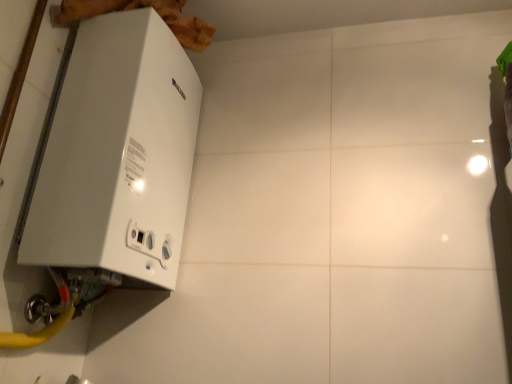
The height and width of the screenshot is (384, 512). What are the coordinates of `white glossy water heater at left` in the screenshot? It's located at (117, 155).

Describe the element at coordinates (117, 155) in the screenshot. This screenshot has height=384, width=512. I see `white glossy water heater at left` at that location.

This screenshot has width=512, height=384. I want to click on white glossy water heater at left, so (117, 155).